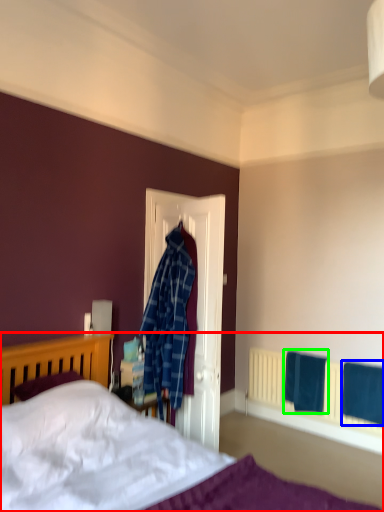
Question: Which object is the farthest from bed (highlighted by a red box)? Choose among these: bath towel (highlighted by a blue box) or bath towel (highlighted by a green box).

Choices:
 (A) bath towel
 (B) bath towel

Answer: (A)